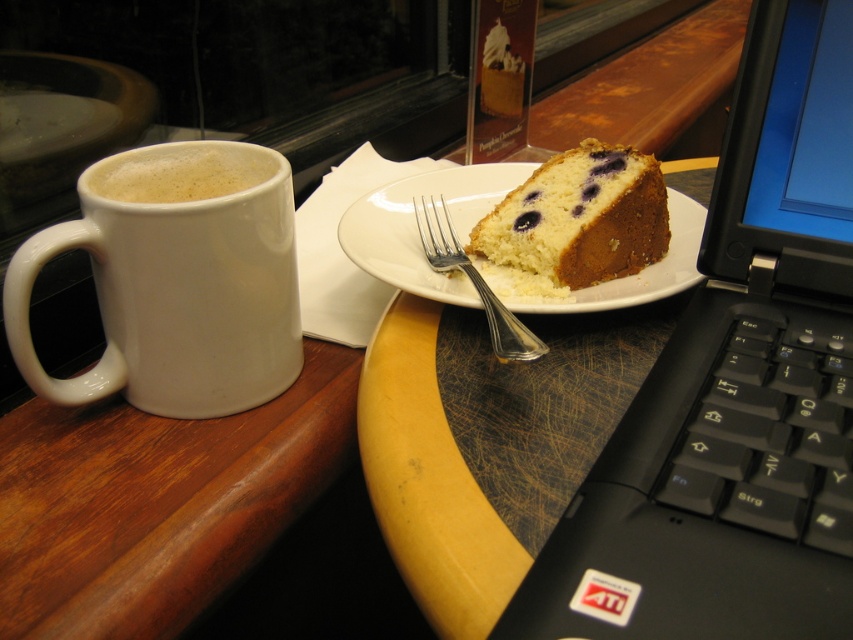
You are setting up a desk arrangement and want to place both the black plastic laptop at right and the white glossy mug at left on the same shelf. The shelf has a height limit of 15 cm. Can both items fit vertically without exceeding the height restriction?

The black plastic laptop at right is taller than the white glossy mug at left. However, since the shelf has a height limit of 15 cm, we need to know the exact heights of both items. Unfortunately, the provided information does not specify their individual heights, only their relative sizes. Therefore, it is impossible to determine if both will fit without additional measurements.

You are organizing a small desk space and need to place both the black plastic laptop at right and the silver metallic fork at center. Since the laptop is taller than the fork, which object should you place in a spot that can accommodate its height?

The black plastic laptop at right is taller than the silver metallic fork at center, so you should place the black plastic laptop at right in the spot that can accommodate its height.